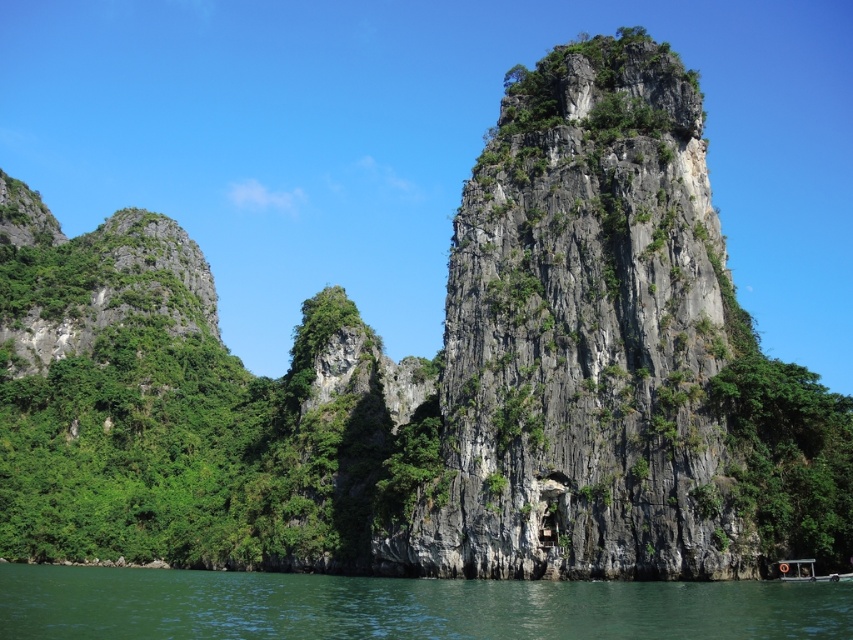
Which is in front, point (589, 561) or point (509, 605)?

Positioned in front is point (509, 605).

In the scene shown: Can you confirm if gray rocky cliff at center is positioned to the left of green water at lower center?

In fact, gray rocky cliff at center is to the right of green water at lower center.

Find the location of a particular element. gray rocky cliff at center is located at coordinates (585, 337).